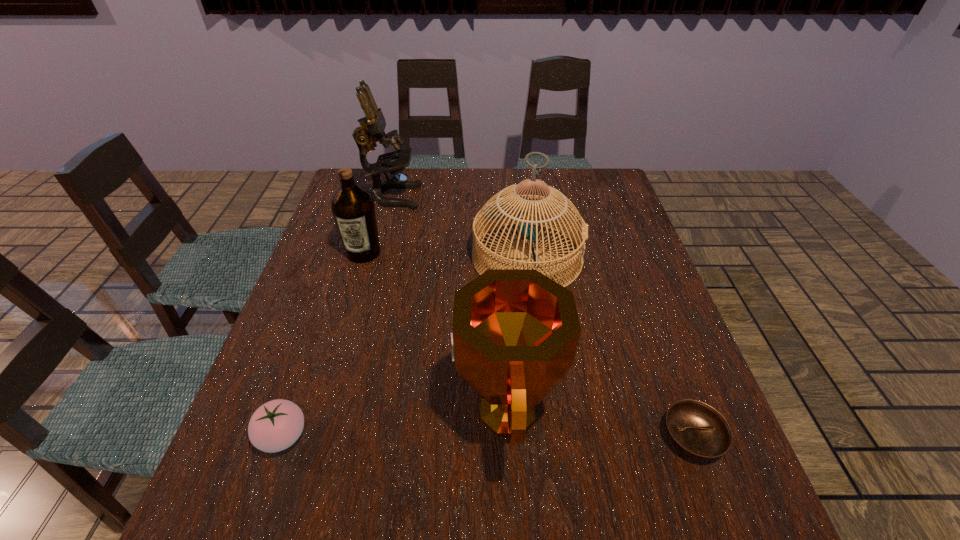
Image resolution: width=960 pixels, height=540 pixels. I want to click on object that is the third closest to the birdcage, so click(x=353, y=208).

At what (x,y) coordinates should I click in order to perform the action: click on free space that satisfies the following two spatial constraints: 1. on the label of the olive oil; 2. on the right side of the shortest object. Please return your answer as a coordinate pair (x, y). Looking at the image, I should click on (308, 437).

Where is `free spot that satisfies the following two spatial constraints: 1. on the front side of the fifth tallest object; 2. on the right side of the rightmost object`? The height and width of the screenshot is (540, 960). free spot that satisfies the following two spatial constraints: 1. on the front side of the fifth tallest object; 2. on the right side of the rightmost object is located at coordinates (282, 437).

The width and height of the screenshot is (960, 540). I want to click on vacant position in the image that satisfies the following two spatial constraints: 1. at the eyepieces of the farthest object; 2. on the right side of the soup bowl, so click(326, 437).

Where is `free space that satisfies the following two spatial constraints: 1. on the label of the rightmost object; 2. on the left side of the olive oil`? The image size is (960, 540). free space that satisfies the following two spatial constraints: 1. on the label of the rightmost object; 2. on the left side of the olive oil is located at coordinates (308, 437).

This screenshot has width=960, height=540. What are the coordinates of `free space that satisfies the following two spatial constraints: 1. on the label of the birdcage; 2. on the left side of the olive oil` in the screenshot? It's located at (362, 257).